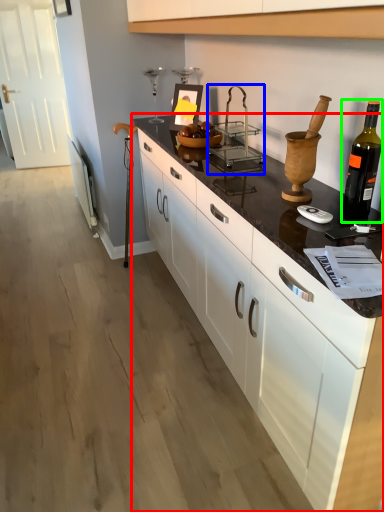
Question: Based on their relative distances, which object is farther from countertop (highlighted by a red box)? Choose from appliance (highlighted by a blue box) and bottle (highlighted by a green box).

Choices:
 (A) appliance
 (B) bottle

Answer: (A)